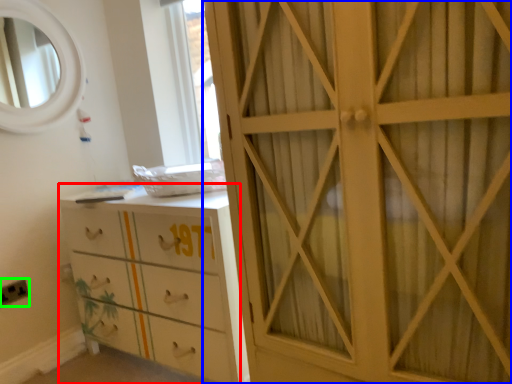
Question: Based on their relative distances, which object is nearer to chest of drawers (highlighted by a red box)? Choose from cupboard (highlighted by a blue box) and electric outlet (highlighted by a green box).

Choices:
 (A) cupboard
 (B) electric outlet

Answer: (A)